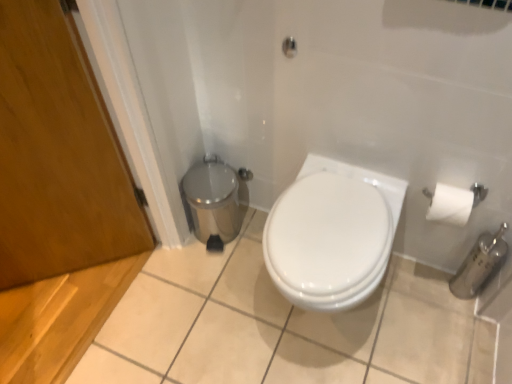
Question: From a real-world perspective, is wooden door at left below matte silver shower at upper center?

Choices:
 (A) no
 (B) yes

Answer: (B)

Question: Is wooden door at left thinner than matte silver shower at upper center?

Choices:
 (A) yes
 (B) no

Answer: (B)

Question: Is the position of wooden door at left more distant than that of matte silver shower at upper center?

Choices:
 (A) no
 (B) yes

Answer: (A)

Question: Is wooden door at left not near matte silver shower at upper center?

Choices:
 (A) no
 (B) yes

Answer: (A)

Question: Would you say matte silver shower at upper center is part of wooden door at left's contents?

Choices:
 (A) yes
 (B) no

Answer: (B)

Question: Do you think polished stainless steel trash can at lower left is within wooden door at left, or outside of it?

Choices:
 (A) outside
 (B) inside

Answer: (A)

Question: From the image's perspective, relative to wooden door at left, is polished stainless steel trash can at lower left above or below?

Choices:
 (A) above
 (B) below

Answer: (B)

Question: Looking at their shapes, would you say polished stainless steel trash can at lower left is wider or thinner than wooden door at left?

Choices:
 (A) wide
 (B) thin

Answer: (A)

Question: Is polished stainless steel trash can at lower left bigger or smaller than wooden door at left?

Choices:
 (A) big
 (B) small

Answer: (B)

Question: In terms of height, does white glossy toilet at center look taller or shorter compared to wooden door at left?

Choices:
 (A) short
 (B) tall

Answer: (A)

Question: Looking at their shapes, would you say white glossy toilet at center is wider or thinner than wooden door at left?

Choices:
 (A) thin
 (B) wide

Answer: (B)

Question: In the image, is white glossy toilet at center positioned in front of or behind wooden door at left?

Choices:
 (A) front
 (B) behind

Answer: (B)

Question: Is white glossy toilet at center situated inside wooden door at left or outside?

Choices:
 (A) inside
 (B) outside

Answer: (B)

Question: From a real-world perspective, relative to matte silver shower at upper center, is white glossy toilet at center vertically above or below?

Choices:
 (A) below
 (B) above

Answer: (A)

Question: From the image's perspective, is white glossy toilet at center positioned above or below matte silver shower at upper center?

Choices:
 (A) below
 (B) above

Answer: (A)